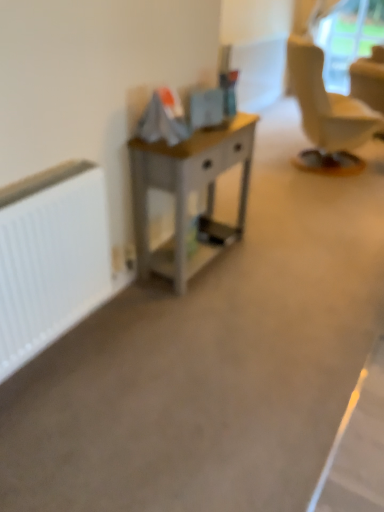
Where is `wooden desk at center`? This screenshot has width=384, height=512. wooden desk at center is located at coordinates (188, 193).

What do you see at coordinates (51, 260) in the screenshot?
I see `white matte radiator at left` at bounding box center [51, 260].

The image size is (384, 512). Find the location of `transparent plastic window screen at upper right`. transparent plastic window screen at upper right is located at coordinates (347, 38).

From the image's perspective, is transparent plastic window screen at upper right below white matte radiator at left?

No.

From a real-world perspective, who is located higher, transparent plastic window screen at upper right or white matte radiator at left?

transparent plastic window screen at upper right.

Which object is more forward, transparent plastic window screen at upper right or white matte radiator at left?

white matte radiator at left.

From a real-world perspective, relative to wooden desk at center, is white matte radiator at left vertically above or below?

Clearly, from a real-world perspective, white matte radiator at left is above wooden desk at center.

How far apart are white matte radiator at left and wooden desk at center?

white matte radiator at left and wooden desk at center are 57.19 centimeters apart from each other.

Is white matte radiator at left looking in the opposite direction of wooden desk at center?

No.

Can you confirm if transparent plastic window screen at upper right is shorter than wooden desk at center?

In fact, transparent plastic window screen at upper right may be taller than wooden desk at center.

Could you tell me if transparent plastic window screen at upper right is turned towards wooden desk at center?

Yes, transparent plastic window screen at upper right faces towards wooden desk at center.

Between transparent plastic window screen at upper right and wooden desk at center, which one has smaller size?

Smaller between the two is transparent plastic window screen at upper right.

Which is more to the left, transparent plastic window screen at upper right or wooden desk at center?

Positioned to the left is wooden desk at center.

Does wooden desk at center have a lesser height compared to transparent plastic window screen at upper right?

Correct, wooden desk at center is not as tall as transparent plastic window screen at upper right.

Is wooden desk at center wider than transparent plastic window screen at upper right?

Yes, wooden desk at center is wider than transparent plastic window screen at upper right.

Which object is closer to the camera, wooden desk at center or transparent plastic window screen at upper right?

wooden desk at center.

Is wooden desk at center facing away from transparent plastic window screen at upper right?

No, transparent plastic window screen at upper right is not at the back of wooden desk at center.

Considering the relative sizes of wooden desk at center and white matte radiator at left in the image provided, is wooden desk at center bigger than white matte radiator at left?

Yes.

Between wooden desk at center and white matte radiator at left, which one appears on the left side from the viewer's perspective?

From the viewer's perspective, white matte radiator at left appears more on the left side.

Does wooden desk at center have a greater width compared to white matte radiator at left?

Yes.

How different are the orientations of wooden desk at center and white matte radiator at left in degrees?

There is a 0.59-degree angle between the facing directions of wooden desk at center and white matte radiator at left.

Could you tell me if white matte radiator at left is turned towards transparent plastic window screen at upper right?

No, white matte radiator at left is not oriented towards transparent plastic window screen at upper right.

Locate an element on the screen. window screen behind the white matte radiator at left is located at coordinates (347, 38).

Can you confirm if white matte radiator at left is bigger than transparent plastic window screen at upper right?

No.

Between white matte radiator at left and transparent plastic window screen at upper right, which one has less height?

white matte radiator at left.

Image resolution: width=384 pixels, height=512 pixels. In order to click on window screen on the right of the white matte radiator at left in this screenshot , I will do `click(347, 38)`.

Identify the location of desk above the white matte radiator at left (from the image's perspective). [x=188, y=193].

Looking at the image, which one is located further to white matte radiator at left, transparent plastic window screen at upper right or wooden desk at center?

transparent plastic window screen at upper right lies further to white matte radiator at left than the other object.

When comparing their distances from transparent plastic window screen at upper right, does wooden desk at center or white matte radiator at left seem further?

white matte radiator at left lies further to transparent plastic window screen at upper right than the other object.

When comparing their distances from wooden desk at center, does white matte radiator at left or transparent plastic window screen at upper right seem closer?

white matte radiator at left lies closer to wooden desk at center than the other object.

When comparing their distances from transparent plastic window screen at upper right, does white matte radiator at left or wooden desk at center seem closer?

The object closer to transparent plastic window screen at upper right is wooden desk at center.

Estimate the real-world distances between objects in this image. Which object is further from white matte radiator at left, wooden desk at center or transparent plastic window screen at upper right?

transparent plastic window screen at upper right.

Which object lies further to the anchor point wooden desk at center, transparent plastic window screen at upper right or white matte radiator at left?

transparent plastic window screen at upper right lies further to wooden desk at center than the other object.

I want to click on desk positioned between white matte radiator at left and transparent plastic window screen at upper right from near to far, so click(x=188, y=193).